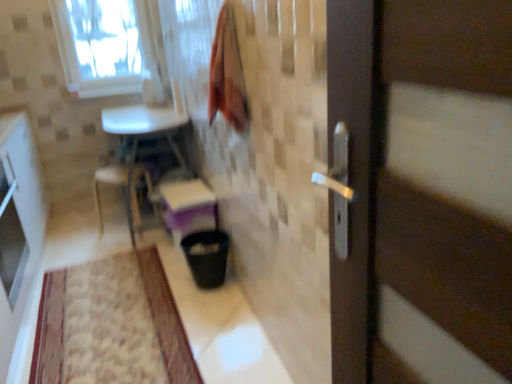
Question: Could you tell me if white plastic chair at lower left is turned towards transparent glass window at upper left?

Choices:
 (A) no
 (B) yes

Answer: (A)

Question: Is white plastic chair at lower left shorter than transparent glass window at upper left?

Choices:
 (A) yes
 (B) no

Answer: (A)

Question: Is white plastic chair at lower left thinner than transparent glass window at upper left?

Choices:
 (A) no
 (B) yes

Answer: (A)

Question: From a real-world perspective, is white plastic chair at lower left located beneath transparent glass window at upper left?

Choices:
 (A) no
 (B) yes

Answer: (B)

Question: Does white plastic chair at lower left have a smaller size compared to transparent glass window at upper left?

Choices:
 (A) yes
 (B) no

Answer: (B)

Question: Does white plastic chair at lower left appear on the left side of transparent glass window at upper left?

Choices:
 (A) no
 (B) yes

Answer: (A)

Question: Can you confirm if beige textured mat at lower left is thinner than white glossy cabinet at left?

Choices:
 (A) yes
 (B) no

Answer: (B)

Question: Is beige textured mat at lower left oriented away from white glossy cabinet at left?

Choices:
 (A) yes
 (B) no

Answer: (B)

Question: Can you confirm if beige textured mat at lower left is smaller than white glossy cabinet at left?

Choices:
 (A) yes
 (B) no

Answer: (A)

Question: From the image's perspective, is beige textured mat at lower left on white glossy cabinet at left?

Choices:
 (A) yes
 (B) no

Answer: (B)

Question: From a real-world perspective, does beige textured mat at lower left sit lower than white glossy cabinet at left?

Choices:
 (A) yes
 (B) no

Answer: (A)

Question: Is beige textured mat at lower left positioned beyond the bounds of white glossy cabinet at left?

Choices:
 (A) yes
 (B) no

Answer: (A)

Question: From a real-world perspective, is white plastic chair at lower left below black plastic trash can at lower center?

Choices:
 (A) yes
 (B) no

Answer: (B)